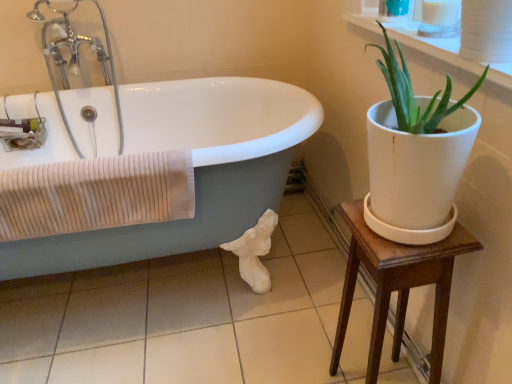
Question: Is white glossy bathtub at left completely or partially outside of beige ribbed towel at left?

Choices:
 (A) no
 (B) yes

Answer: (B)

Question: Is beige ribbed towel at left completely or partially inside white glossy bathtub at left?

Choices:
 (A) yes
 (B) no

Answer: (A)

Question: Can you confirm if white glossy bathtub at left is taller than beige ribbed towel at left?

Choices:
 (A) yes
 (B) no

Answer: (A)

Question: Is white glossy bathtub at left closer to camera compared to beige ribbed towel at left?

Choices:
 (A) yes
 (B) no

Answer: (A)

Question: From a real-world perspective, is white glossy bathtub at left over beige ribbed towel at left?

Choices:
 (A) no
 (B) yes

Answer: (A)

Question: Can you confirm if white glossy bathtub at left is positioned to the left of beige ribbed towel at left?

Choices:
 (A) yes
 (B) no

Answer: (A)

Question: From a real-world perspective, is wooden table at right positioned under white glossy tile at lower center based on gravity?

Choices:
 (A) no
 (B) yes

Answer: (A)

Question: Considering the relative sizes of wooden table at right and white glossy tile at lower center in the image provided, is wooden table at right smaller than white glossy tile at lower center?

Choices:
 (A) no
 (B) yes

Answer: (B)

Question: Does wooden table at right touch white glossy tile at lower center?

Choices:
 (A) yes
 (B) no

Answer: (B)

Question: From the image's perspective, does wooden table at right appear higher than white glossy tile at lower center?

Choices:
 (A) no
 (B) yes

Answer: (B)

Question: Would you say wooden table at right is outside white glossy tile at lower center?

Choices:
 (A) yes
 (B) no

Answer: (A)

Question: Does wooden table at right have a greater width compared to white glossy tile at lower center?

Choices:
 (A) yes
 (B) no

Answer: (B)

Question: Is white glossy bathtub at left turned away from white glossy tile at lower center?

Choices:
 (A) yes
 (B) no

Answer: (B)